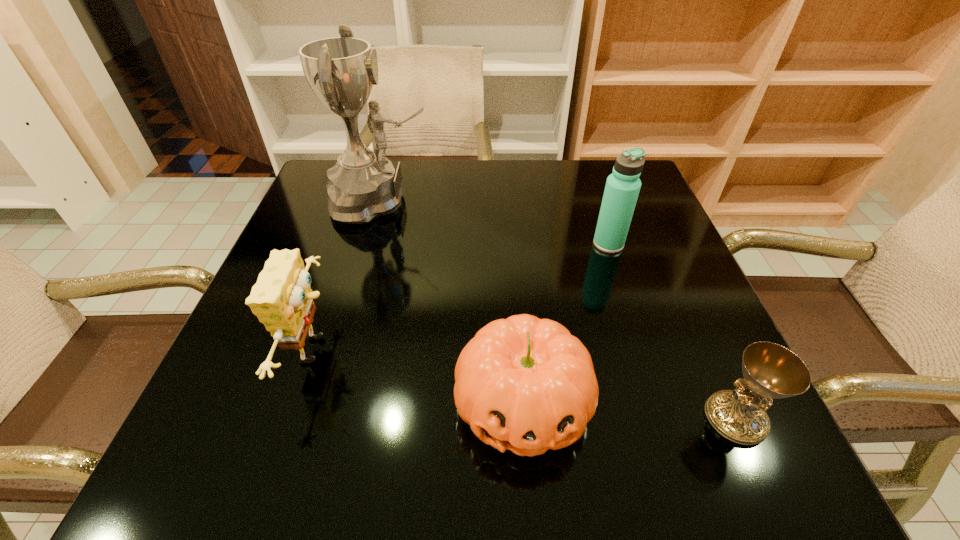
In the image, there is a desktop. Identify the location of vacant space at the near edge. (466, 426).

In the image, there is a desktop. At what (x,y) coordinates should I click in order to perform the action: click on vacant space at the left edge. Please return your answer as a coordinate pair (x, y). Looking at the image, I should click on (259, 333).

In the image, there is a desktop. Where is `vacant space at the right edge`? This screenshot has height=540, width=960. vacant space at the right edge is located at coordinates (662, 278).

You are a GUI agent. You are given a task and a screenshot of the screen. Output one action in this format:
    pyautogui.click(x=<x>, y=<y>)
    Task: Click on the vacant position at the near left corner of the desktop
    This screenshot has height=540, width=960.
    Given the screenshot: What is the action you would take?
    [x=207, y=439]

Image resolution: width=960 pixels, height=540 pixels. In the image, there is a desktop. What are the coordinates of `free space at the far right corner` in the screenshot? It's located at (593, 182).

Where is `vacant space at the near right corner of the desktop`? This screenshot has height=540, width=960. vacant space at the near right corner of the desktop is located at coordinates (741, 461).

Image resolution: width=960 pixels, height=540 pixels. I want to click on free spot between the tallest object and the thermos bottle, so click(494, 222).

Identify the location of unoccupied area between the pumpkin and the fourth object from left to right. (565, 323).

The height and width of the screenshot is (540, 960). Identify the location of free space between the fourth shortest object and the chalice. (672, 331).

Where is `unoccupied position between the sponge and the award`? The width and height of the screenshot is (960, 540). unoccupied position between the sponge and the award is located at coordinates (348, 275).